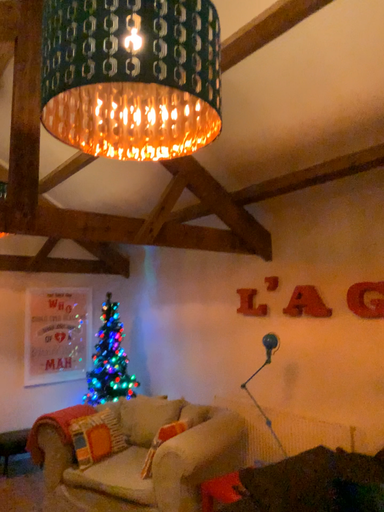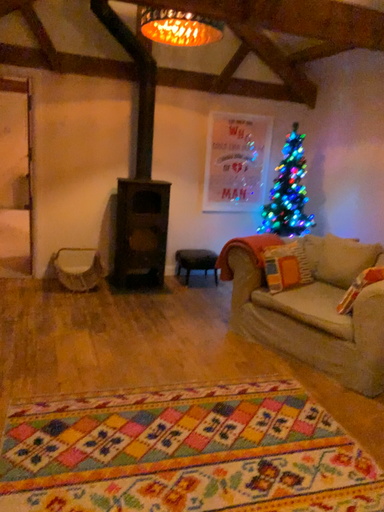
Question: Which way did the camera rotate in the video?

Choices:
 (A) rotated right
 (B) rotated left

Answer: (B)